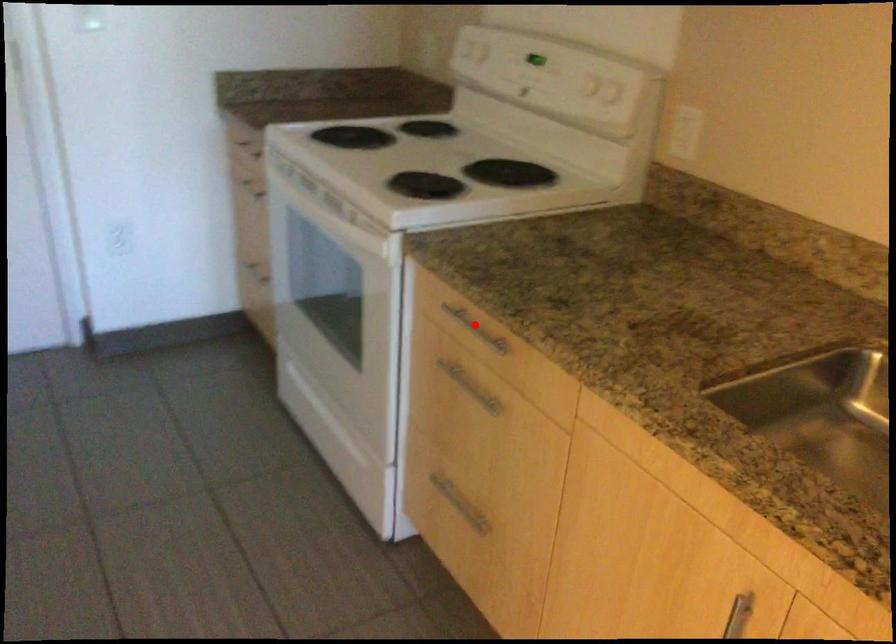
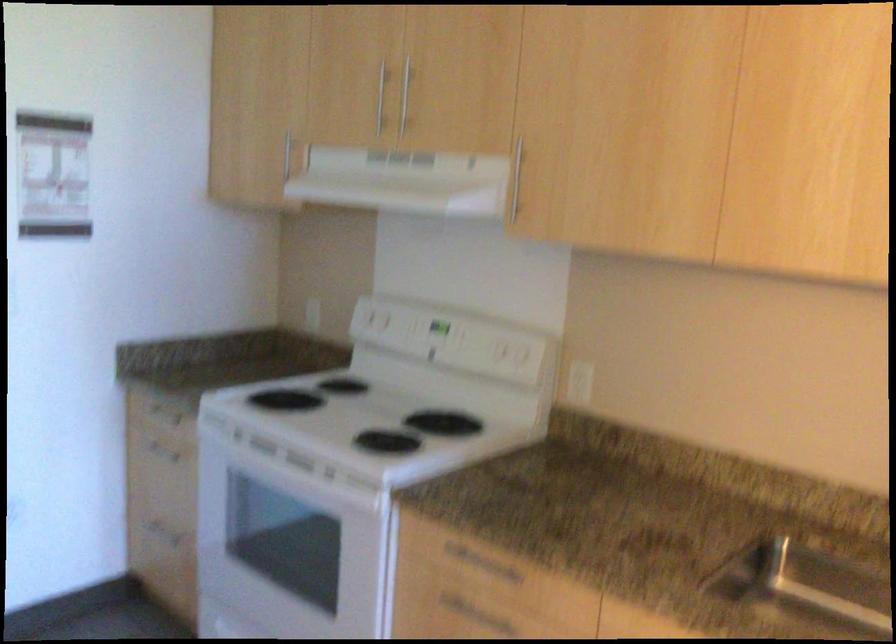
Question: I am providing you with two images of the same scene from different viewpoints. A red point is shown in image1. For the corresponding object point in image2, is it positioned nearer or farther from the camera?

Choices:
 (A) Nearer
 (B) Farther

Answer: (B)